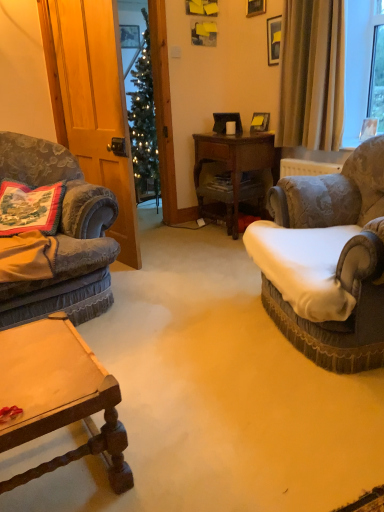
Question: Does embroidered fabric pillow at left have a larger size compared to wooden picture frame at upper center, the 2th picture frame when ordered from back to front?

Choices:
 (A) no
 (B) yes

Answer: (B)

Question: From the image's perspective, is embroidered fabric pillow at left located above wooden picture frame at upper center, which is the 1th picture frame from right to left?

Choices:
 (A) yes
 (B) no

Answer: (B)

Question: Considering the relative sizes of embroidered fabric pillow at left and wooden picture frame at upper center, positioned as the second picture frame in left-to-right order, in the image provided, is embroidered fabric pillow at left smaller than wooden picture frame at upper center, positioned as the second picture frame in left-to-right order,?

Choices:
 (A) no
 (B) yes

Answer: (A)

Question: From a real-world perspective, is embroidered fabric pillow at left beneath wooden picture frame at upper center, the 2th picture frame when ordered from back to front?

Choices:
 (A) no
 (B) yes

Answer: (B)

Question: Does embroidered fabric pillow at left have a greater width compared to wooden picture frame at upper center, the 2th picture frame when ordered from back to front?

Choices:
 (A) no
 (B) yes

Answer: (B)

Question: Would you say embroidered fabric pillow at left is outside wooden picture frame at upper center, which ranks as the first picture frame in front-to-back order?

Choices:
 (A) no
 (B) yes

Answer: (B)

Question: Would you say wooden desk at center is outside beige fabric curtain at upper right?

Choices:
 (A) yes
 (B) no

Answer: (A)

Question: Considering the relative positions of wooden desk at center and beige fabric curtain at upper right in the image provided, is wooden desk at center to the left of beige fabric curtain at upper right from the viewer's perspective?

Choices:
 (A) yes
 (B) no

Answer: (A)

Question: Considering the relative sizes of wooden desk at center and beige fabric curtain at upper right in the image provided, is wooden desk at center wider than beige fabric curtain at upper right?

Choices:
 (A) no
 (B) yes

Answer: (B)

Question: Considering the relative sizes of wooden desk at center and beige fabric curtain at upper right in the image provided, is wooden desk at center bigger than beige fabric curtain at upper right?

Choices:
 (A) yes
 (B) no

Answer: (A)

Question: Is wooden desk at center positioned before beige fabric curtain at upper right?

Choices:
 (A) yes
 (B) no

Answer: (B)

Question: Is wooden desk at center next to beige fabric curtain at upper right?

Choices:
 (A) no
 (B) yes

Answer: (A)

Question: Considering the relative sizes of wooden picture frame at upper center, which is the 1th picture frame from right to left, and beige fabric curtain at upper right in the image provided, is wooden picture frame at upper center, which is the 1th picture frame from right to left, wider than beige fabric curtain at upper right?

Choices:
 (A) no
 (B) yes

Answer: (A)